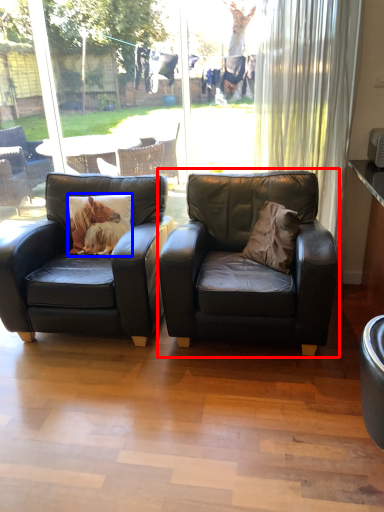
Question: Which object appears farthest to the camera in this image, chair (highlighted by a red box) or pillow (highlighted by a blue box)?

Choices:
 (A) chair
 (B) pillow

Answer: (B)